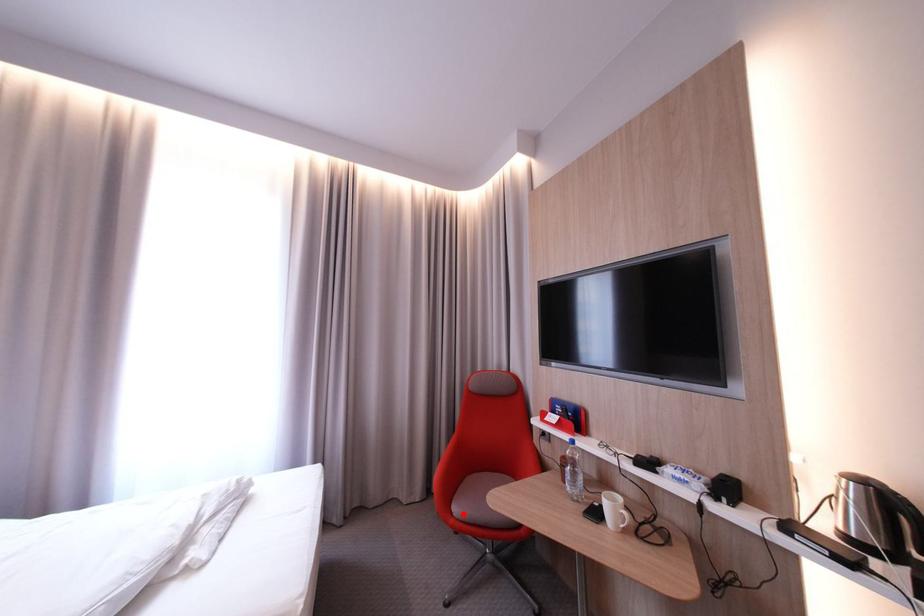
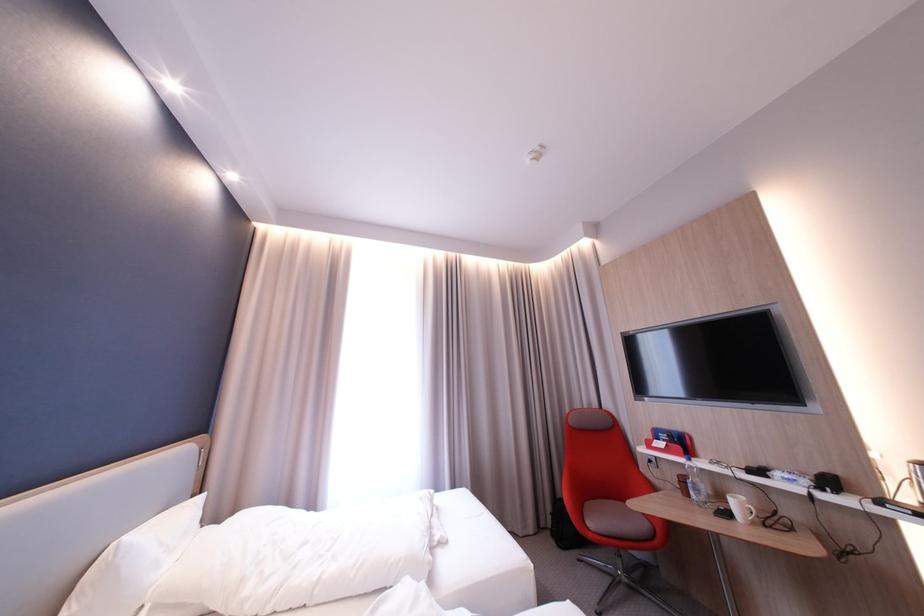
In the second image, find the point that corresponds to the highlighted location in the first image.

(600, 529)